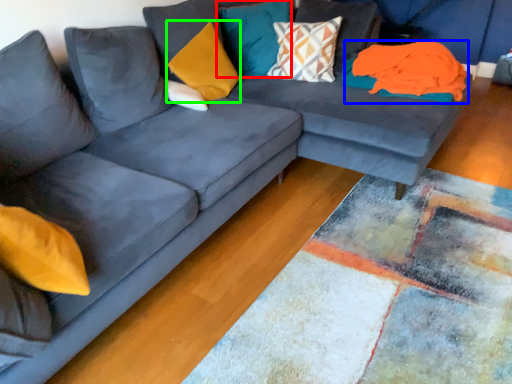
Question: Considering the real-world distances, which object is closest to pillow (highlighted by a red box)? material (highlighted by a blue box) or pillow (highlighted by a green box).

Choices:
 (A) material
 (B) pillow

Answer: (B)